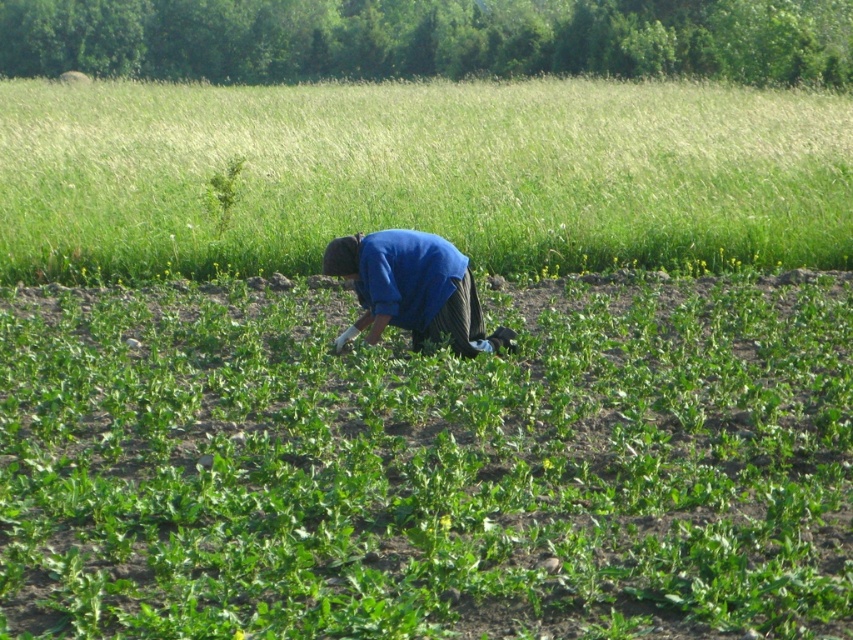
Question: Which point is closer to the camera taking this photo?

Choices:
 (A) (451, 296)
 (B) (590, 426)
 (C) (292, 257)

Answer: (B)

Question: Is green leafy grass at center behind green grass at center?

Choices:
 (A) no
 (B) yes

Answer: (A)

Question: Is green leafy grass at center wider than green grass at center?

Choices:
 (A) yes
 (B) no

Answer: (B)

Question: From the image, what is the correct spatial relationship of green leafy grass at center in relation to green grass at center?

Choices:
 (A) right
 (B) left

Answer: (A)

Question: Which point appears farthest from the camera in this image?

Choices:
 (A) (341, 260)
 (B) (271, 340)

Answer: (B)

Question: Which is nearer to the green grass at center?

Choices:
 (A) green leafy grass at center
 (B) blue fabric at center

Answer: (A)